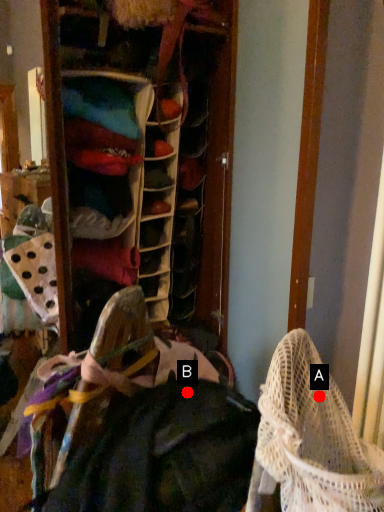
Question: Two points are circled on the image, labeled by A and B beside each circle. Which point is closer to the camera?

Choices:
 (A) A is closer
 (B) B is closer

Answer: (A)